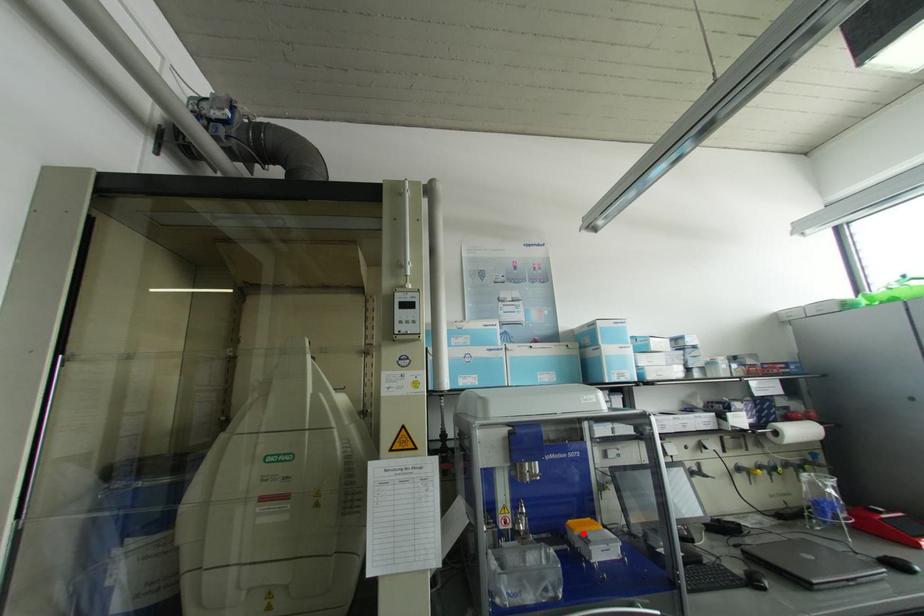
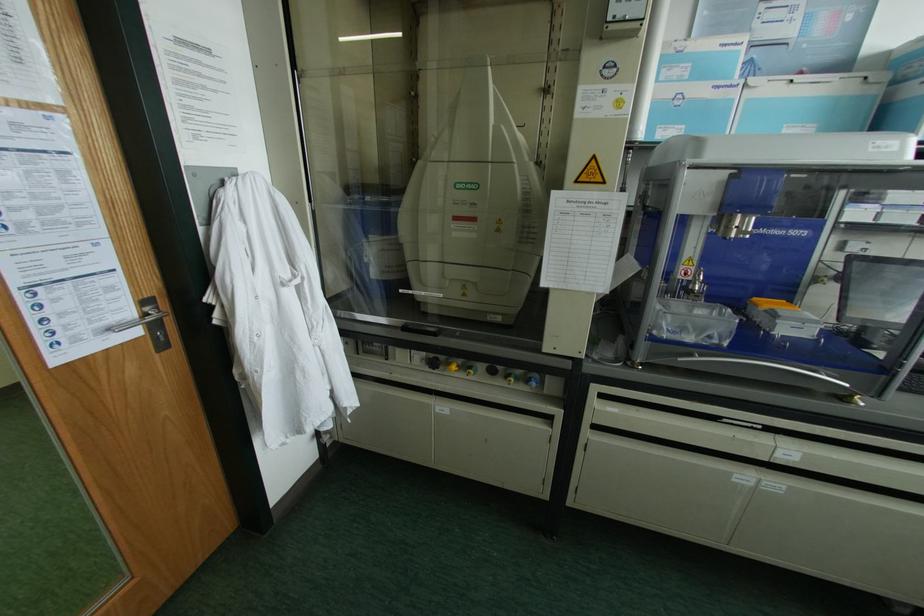
Locate, in the second image, the point that corresponds to the highlighted location in the first image.

(772, 310)